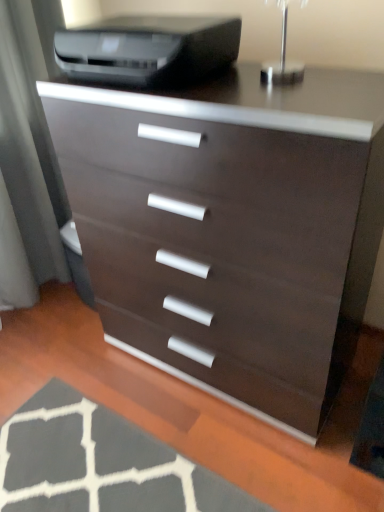
In order to click on blank area beneath dark gray textured rug at lower left (from a real-world perspective) in this screenshot , I will do [105, 464].